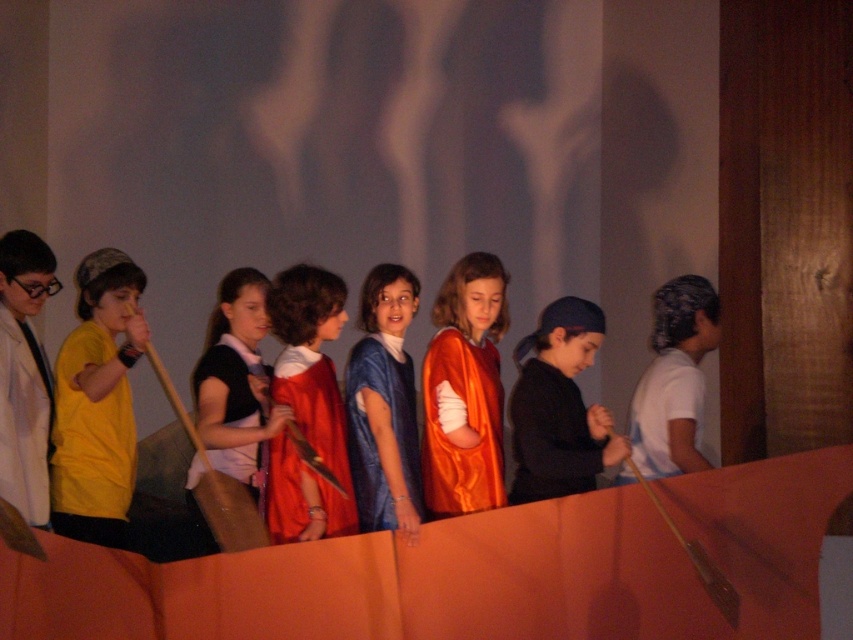
Does satin orange robe at center appear on the left side of matte orange cape at center?

Incorrect, satin orange robe at center is not on the left side of matte orange cape at center.

Consider the image. Is satin orange robe at center to the right of matte orange cape at center from the viewer's perspective?

Indeed, satin orange robe at center is positioned on the right side of matte orange cape at center.

Is point (496, 369) positioned before point (223, 448)?

No, it is behind (223, 448).

In order to click on satin orange robe at center in this screenshot , I will do `click(463, 390)`.

Between point (248, 412) and point (393, 310), which one is positioned behind?

The point (393, 310) is more distant.

Does matte orange cape at center appear over blue satin dress at center?

Incorrect, matte orange cape at center is not positioned above blue satin dress at center.

Between point (207, 493) and point (405, 304), which one is positioned behind?

Positioned behind is point (405, 304).

Image resolution: width=853 pixels, height=640 pixels. What are the coordinates of `matte orange cape at center` in the screenshot? It's located at (233, 410).

Which is in front, point (473, 349) or point (381, 477)?

Point (381, 477) is in front.

Does satin orange robe at center appear under blue satin dress at center?

No.

Is point (485, 468) positioned behind point (349, 428)?

That is False.

The width and height of the screenshot is (853, 640). What are the coordinates of `satin orange robe at center` in the screenshot? It's located at (463, 390).